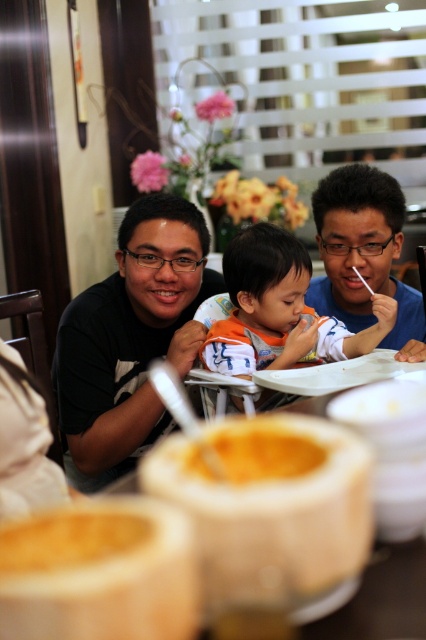
Does yellow matte coconut at lower center have a lesser width compared to yellow creamy soup at center?

Yes, yellow matte coconut at lower center is thinner than yellow creamy soup at center.

Who is more distant from viewer, (106, 522) or (201, 470)?

Point (201, 470)

Who is more forward, (94, 516) or (293, 465)?

Point (94, 516)

You are a GUI agent. You are given a task and a screenshot of the screen. Output one action in this format:
    pyautogui.click(x=<x>, y=<y>)
    Task: Click on the yellow matte coconut at lower center
    The height and width of the screenshot is (640, 426).
    Given the screenshot: What is the action you would take?
    pyautogui.click(x=69, y=540)

Can you confirm if smooth beige bowl at center is positioned to the right of matte black shirt at upper right?

Incorrect, smooth beige bowl at center is not on the right side of matte black shirt at upper right.

Is point (175, 563) farther from viewer compared to point (360, 184)?

No, it is in front of (360, 184).

This screenshot has width=426, height=640. What do you see at coordinates (100, 572) in the screenshot?
I see `smooth beige bowl at center` at bounding box center [100, 572].

Locate an element on the screen. This screenshot has height=640, width=426. smooth beige bowl at center is located at coordinates (100, 572).

Is orange cotton shirt at center smaller than matte black shirt at upper right?

Indeed, orange cotton shirt at center has a smaller size compared to matte black shirt at upper right.

Which is behind, point (291, 337) or point (368, 268)?

The point (368, 268) is more distant.

Find the location of a particular element. This screenshot has height=640, width=426. orange cotton shirt at center is located at coordinates (279, 310).